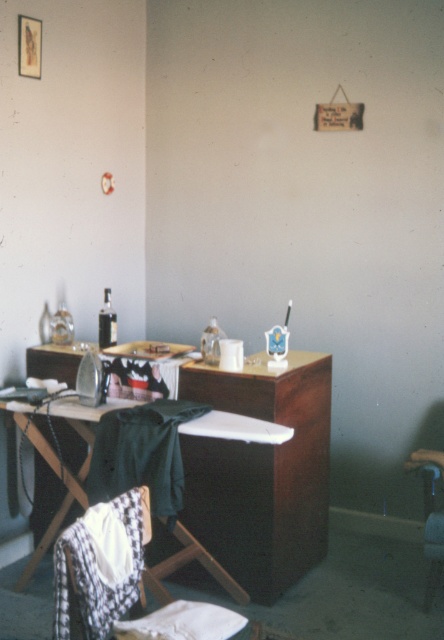
You are organizing a small gathering and need to arrange seating. You have a white fabric armchair at lower left and a dark green fabric at center. Which piece of furniture is closer to the entrance if the entrance is on the right side of the room?

The dark green fabric at center is closer to the entrance because it is positioned to the right of the white fabric armchair at lower left.

You are a cleaning robot with a width of 0.9 meters. You are positioned near the white knitted cloth at lower left and want to move to the wooden ironing board at center. Can you navigate the space between them without any obstacles?

The distance between the white knitted cloth at lower left and wooden ironing board at center is 1.04 meters. Since the robot is 0.9 meters wide, it can fit through the space as the distance is greater than its width.